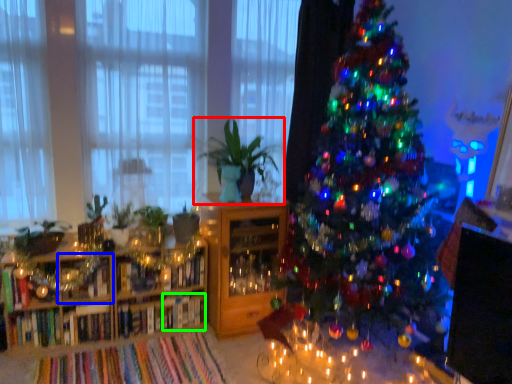
Question: Which object is positioned farthest from houseplant (highlighted by a red box)? Select from shelf (highlighted by a blue box) and book (highlighted by a green box).

Choices:
 (A) shelf
 (B) book

Answer: (A)